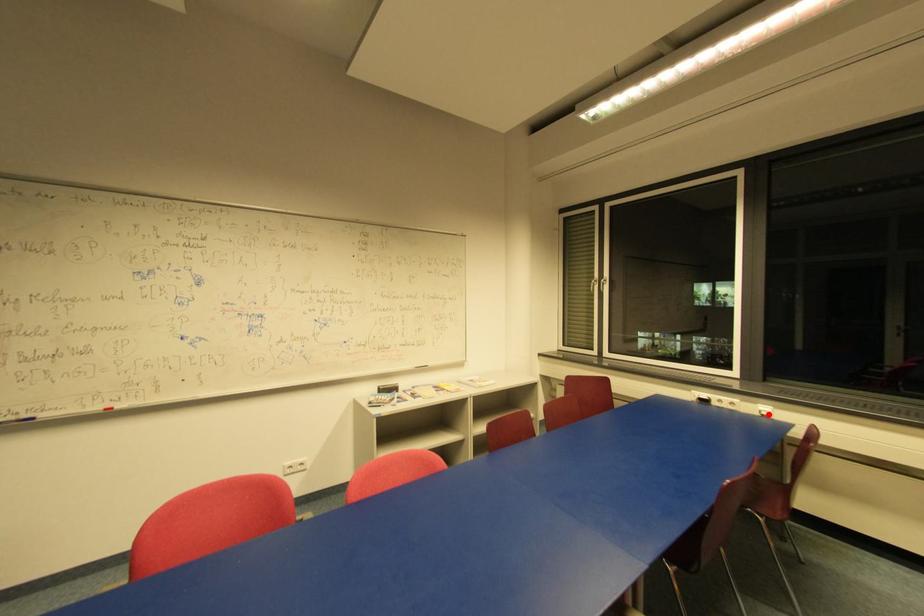
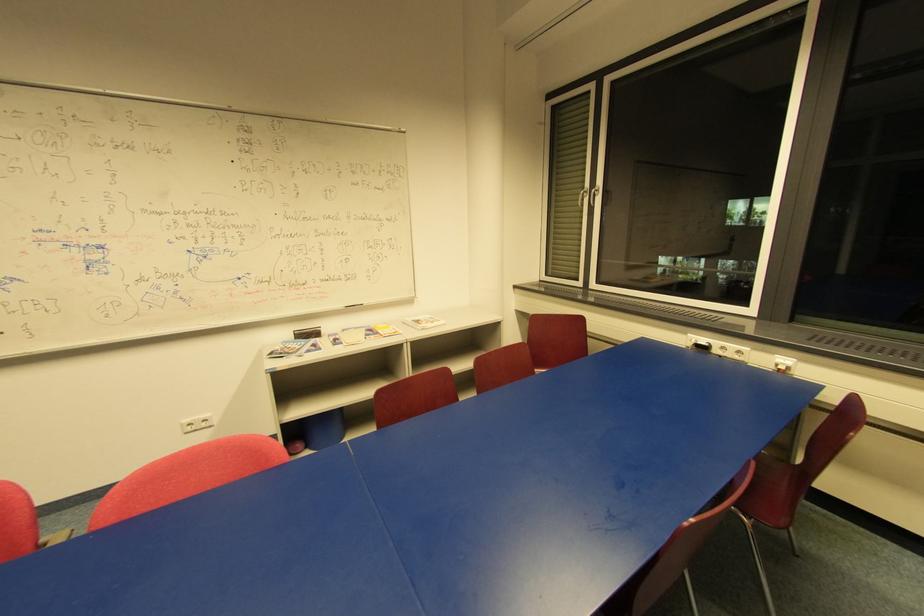
Question: I am providing you with two images of the same scene from different viewpoints. A red point is marked on the first image. Is the red point's position out of view in image 2?

Choices:
 (A) Yes
 (B) No

Answer: (B)